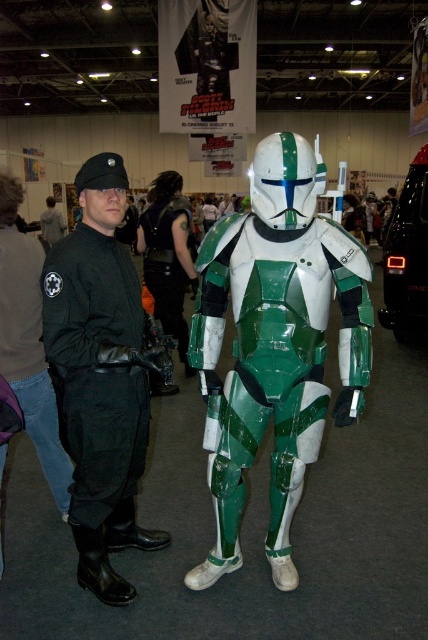
You are a costume designer analyzing the two jackets worn by the person on the left. Which jacket, the black leather jacket at left or the black matte jacket at left, extends higher up the body?

The black leather jacket at left has a greater height compared to the black matte jacket at left, so the black leather jacket at left extends higher up the body.